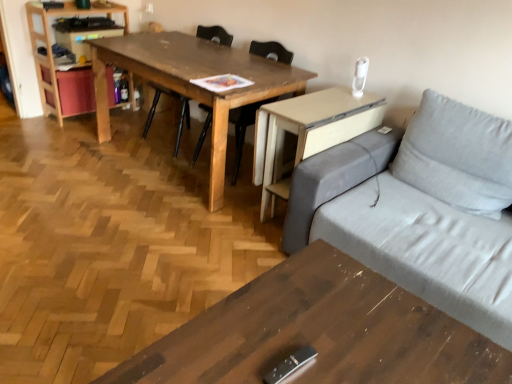
Locate an element on the screen. This screenshot has width=512, height=384. free space between wooden table at center, which is counted as the 2th table, starting from the bottom, and light wood bookshelf at left is located at coordinates (114, 130).